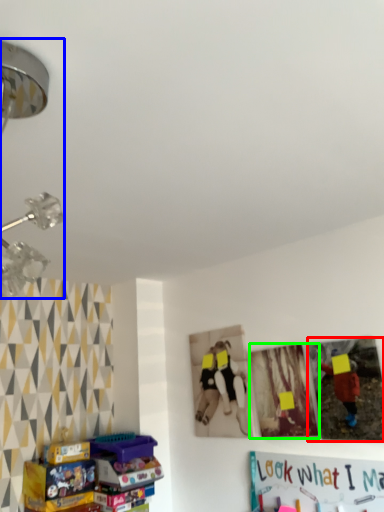
Question: Based on their relative distances, which object is nearer to picture frame (highlighted by a red box)? Choose from lamp (highlighted by a blue box) and picture frame (highlighted by a green box).

Choices:
 (A) lamp
 (B) picture frame

Answer: (B)